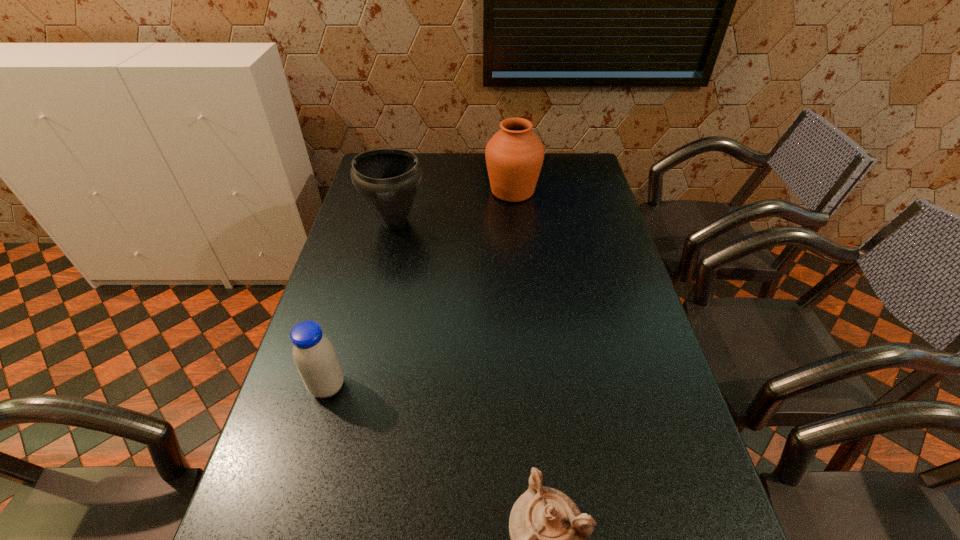
This screenshot has width=960, height=540. What are the coordinates of `the leftmost urn` in the screenshot? It's located at (388, 180).

Locate an element on the screen. the third farthest object is located at coordinates (315, 358).

At what (x,y) coordinates should I click in order to perform the action: click on free location located 0.230m on the front of the leftmost urn. Please return your answer as a coordinate pair (x, y). This screenshot has height=540, width=960. Looking at the image, I should click on (379, 291).

Find the location of a particular element. This screenshot has width=960, height=540. vacant space located 0.260m on the front of the soya milk is located at coordinates (289, 525).

You are a GUI agent. You are given a task and a screenshot of the screen. Output one action in this format:
    pyautogui.click(x=<x>, y=<y>)
    Task: Click on the object that is at the far edge
    The image size is (960, 540).
    Given the screenshot: What is the action you would take?
    pyautogui.click(x=514, y=155)

In order to click on urn at the left edge in this screenshot , I will do `click(388, 180)`.

Identify the location of soya milk at the left edge. (315, 358).

At what (x,y) coordinates should I click in order to perform the action: click on vacant position at the far edge of the desktop. Please return your answer as a coordinate pair (x, y). The height and width of the screenshot is (540, 960). Looking at the image, I should click on (454, 179).

Locate an element on the screen. free spot at the left edge of the desktop is located at coordinates (325, 307).

Where is `free space at the right edge`? This screenshot has height=540, width=960. free space at the right edge is located at coordinates (589, 227).